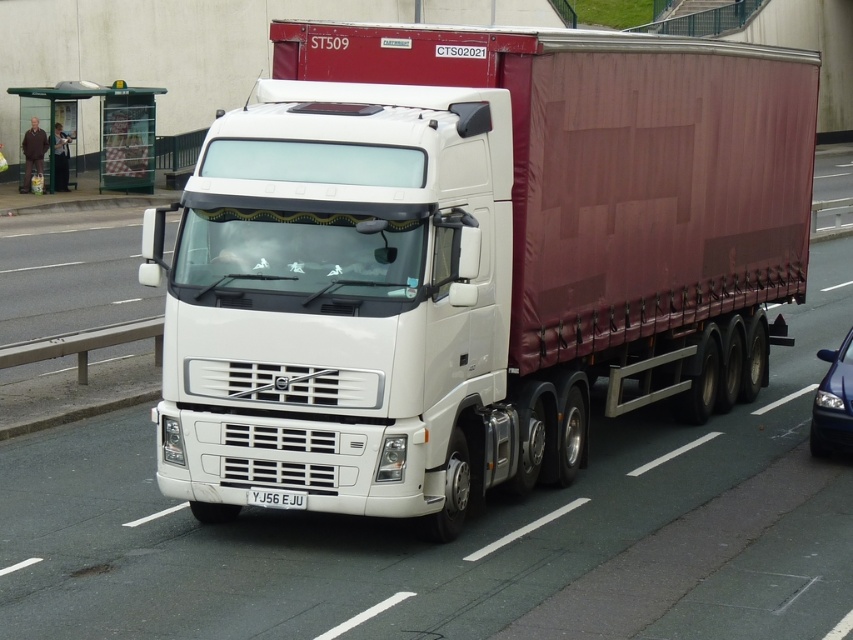
Describe the element at coordinates (471, 259) in the screenshot. I see `white matte truck at center` at that location.

Is the position of white matte truck at center more distant than that of white plastic license plate at center?

That is False.

Between point (265, 348) and point (268, 502), which one is positioned behind?

Positioned behind is point (268, 502).

What are the coordinates of `white matte truck at center` in the screenshot? It's located at (471, 259).

Is white matte truck at center shorter than glossy blue car at right?

In fact, white matte truck at center may be taller than glossy blue car at right.

Between point (285, 433) and point (828, 392), which one is positioned in front?

Point (285, 433) is in front.

Between point (770, 51) and point (833, 358), which one is positioned behind?

Point (770, 51)

Locate an element on the screen. The image size is (853, 640). white matte truck at center is located at coordinates (471, 259).

Does point (821, 403) lie behind point (280, 490)?

Yes, it is.

Which is above, glossy blue car at right or white plastic license plate at center?

glossy blue car at right

Who is more forward, (833, 436) or (270, 504)?

Point (270, 504) is more forward.

The width and height of the screenshot is (853, 640). I want to click on glossy blue car at right, so click(x=833, y=403).